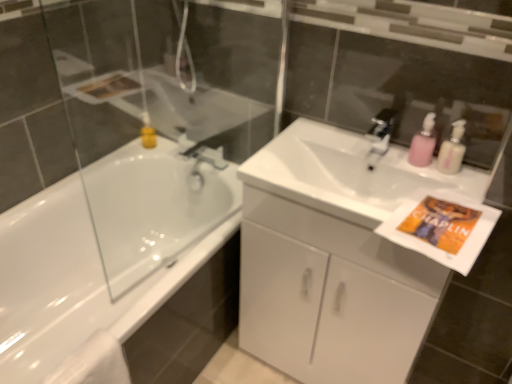
You are a GUI agent. You are given a task and a screenshot of the screen. Output one action in this format:
    pyautogui.click(x=<x>, y=<y>)
    Task: Click on the free spot above white matte towel at lower left (from a real-world perspective)
    
    Given the screenshot: What is the action you would take?
    pyautogui.click(x=84, y=359)